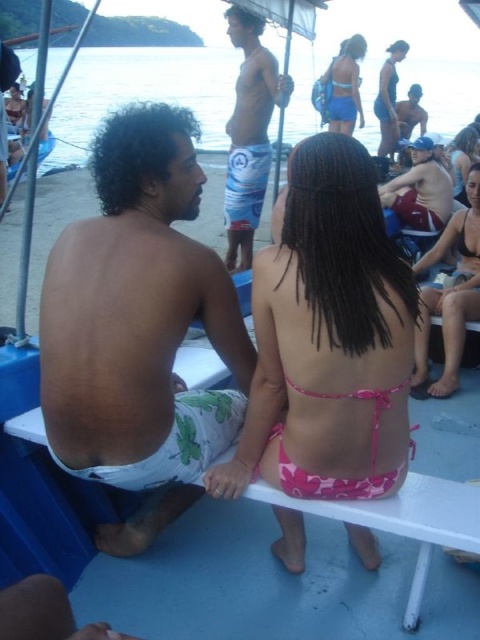
Question: Which of these objects is positioned closest to the pink fabric bikini at upper center?

Choices:
 (A) white floral shorts at left
 (B) blue printed shorts at center
 (C) matte blue shorts at center
 (D) matte black swimsuit at upper right

Answer: (D)

Question: Is pink fabric bikini at upper right to the left of matte white shorts at left from the viewer's perspective?

Choices:
 (A) no
 (B) yes

Answer: (A)

Question: Which of the following is the farthest from the observer?

Choices:
 (A) pink floral bikini at center
 (B) clear blue water at upper center
 (C) matte black swimsuit at upper right

Answer: (C)

Question: Does blue printed shorts at center have a smaller size compared to pink fabric bikini at upper center?

Choices:
 (A) no
 (B) yes

Answer: (A)

Question: Can you confirm if white floral shorts at left is positioned below matte blue shorts at center?

Choices:
 (A) yes
 (B) no

Answer: (A)

Question: Among these objects, which one is nearest to the camera?

Choices:
 (A) matte black swimsuit at upper right
 (B) pink fabric bikini at center
 (C) pink fabric bikini at upper center

Answer: (B)